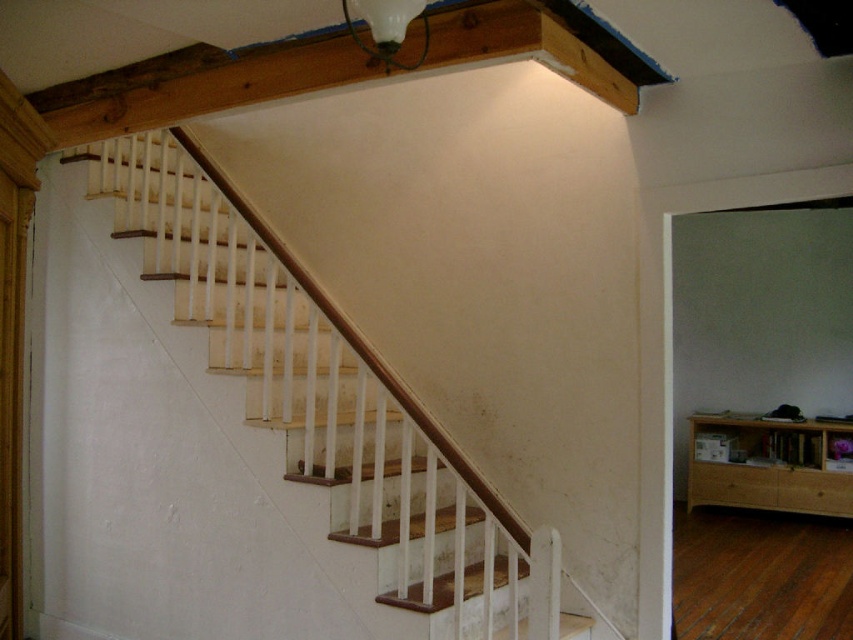
Question: From the image, what is the correct spatial relationship of wooden stairs at center in relation to matte glass lamp at upper center?

Choices:
 (A) above
 (B) below

Answer: (B)

Question: Can you confirm if light brown wood at upper right is bigger than matte glass lamp at upper center?

Choices:
 (A) no
 (B) yes

Answer: (B)

Question: Which object is positioned closest to the wooden stairs at center?

Choices:
 (A) light brown wood at upper right
 (B) matte glass lamp at upper center

Answer: (B)

Question: Can you confirm if light brown wood at upper right is thinner than matte glass lamp at upper center?

Choices:
 (A) yes
 (B) no

Answer: (B)

Question: Among these points, which one is farthest from the camera?

Choices:
 (A) (148, 257)
 (B) (692, 452)

Answer: (B)

Question: Among these objects, which one is farthest from the camera?

Choices:
 (A) wooden stairs at center
 (B) matte glass lamp at upper center
 (C) light brown wood at upper right

Answer: (C)